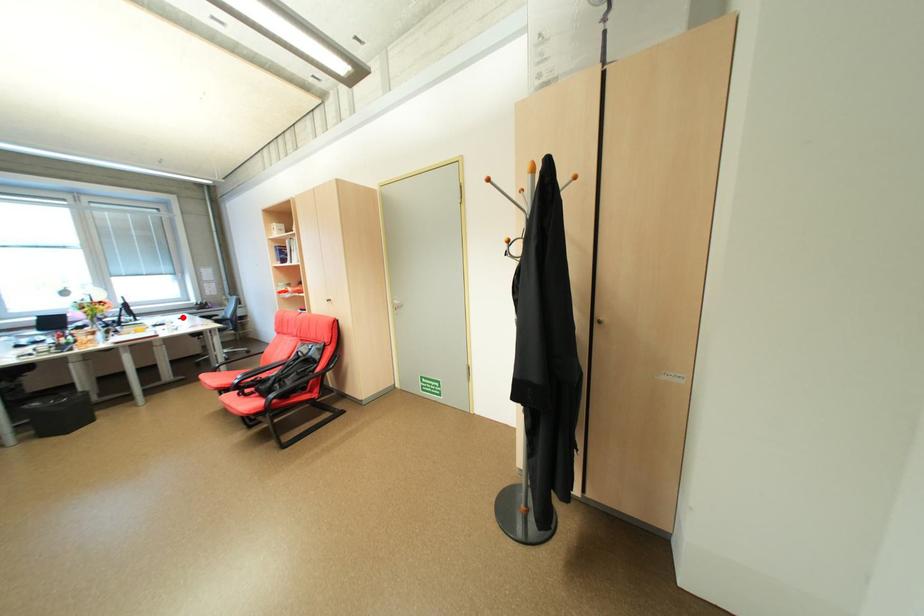
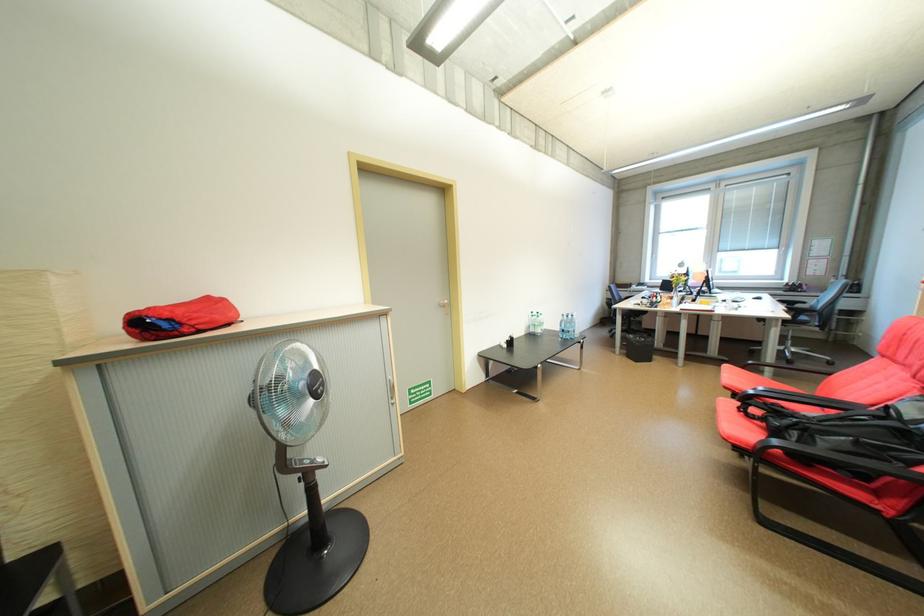
Locate, in the second image, the point that corresponds to the highlighted location in the first image.

(758, 296)